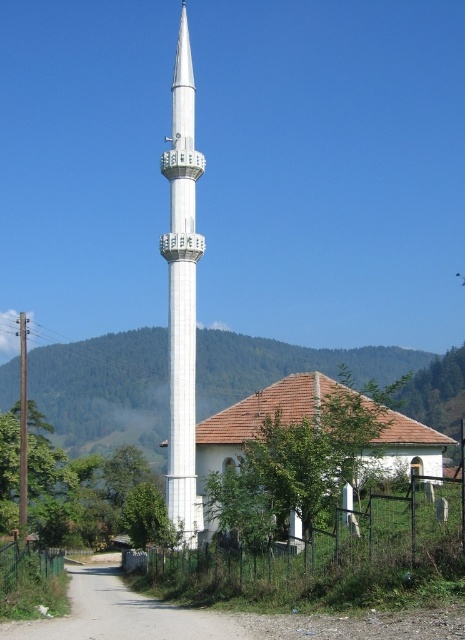
Question: Does metallic wire fence at lower center have a smaller size compared to green wire mesh fence at lower left?

Choices:
 (A) no
 (B) yes

Answer: (A)

Question: Which point appears closest to the camera in this image?

Choices:
 (A) (25, 548)
 (B) (160, 250)
 (C) (309, 547)
 (D) (439, 442)

Answer: (C)

Question: Does white tile roof at center have a greater width compared to green wire mesh fence at lower left?

Choices:
 (A) yes
 (B) no

Answer: (A)

Question: Which point is farther to the camera?

Choices:
 (A) white smooth minaret at center
 (B) white tile roof at center
 (C) green wire mesh fence at lower left

Answer: (A)

Question: Does white smooth minaret at center appear on the left side of green wire mesh fence at lower left?

Choices:
 (A) no
 (B) yes

Answer: (A)

Question: Which point is farther to the camera?

Choices:
 (A) (361, 563)
 (B) (55, 586)
 (C) (312, 376)
 (D) (184, 426)

Answer: (C)